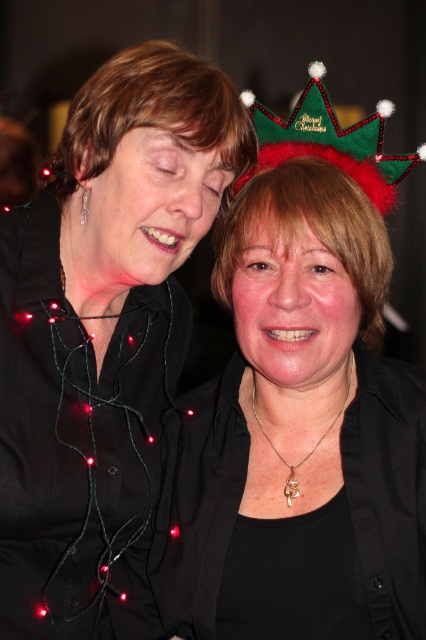
Who is positioned more to the left, matte black hair at upper left or green fuzzy crown at upper right?

matte black hair at upper left is more to the left.

Who is higher up, matte black hair at upper left or green fuzzy crown at upper right?

green fuzzy crown at upper right is above.

Locate an element on the screen. The width and height of the screenshot is (426, 640). matte black hair at upper left is located at coordinates (152, 112).

The width and height of the screenshot is (426, 640). In order to click on matte black hair at upper left in this screenshot , I will do [152, 112].

Who is taller, matte black shirt at upper left or black matte/black textured hair at center?

matte black shirt at upper left is taller.

Does matte black shirt at upper left appear over black matte/black textured hair at center?

Yes.

Who is more forward, (143, 493) or (325, 269)?

Positioned in front is point (325, 269).

Locate an element on the screen. The width and height of the screenshot is (426, 640). matte black shirt at upper left is located at coordinates (103, 337).

Is matte black shirt at upper left closer to camera compared to green fuzzy crown at upper right?

Yes, matte black shirt at upper left is in front of green fuzzy crown at upper right.

Can you confirm if matte black shirt at upper left is thinner than green fuzzy crown at upper right?

No, matte black shirt at upper left is not thinner than green fuzzy crown at upper right.

Where is `matte black shirt at upper left`? The height and width of the screenshot is (640, 426). matte black shirt at upper left is located at coordinates (103, 337).